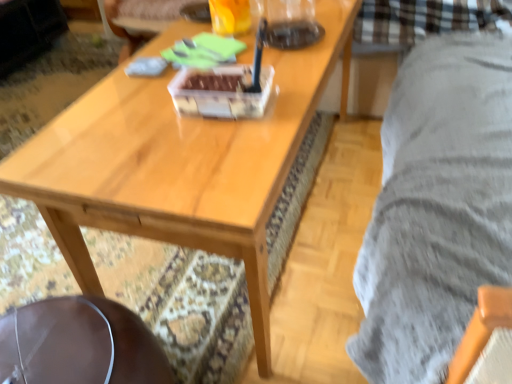
Question: Could wooden coffee table at center be considered to be inside translucent glass beverage at upper center?

Choices:
 (A) yes
 (B) no

Answer: (B)

Question: Does translucent glass beverage at upper center have a lesser width compared to wooden coffee table at center?

Choices:
 (A) no
 (B) yes

Answer: (B)

Question: Does translucent glass beverage at upper center have a greater width compared to wooden coffee table at center?

Choices:
 (A) yes
 (B) no

Answer: (B)

Question: Is translucent glass beverage at upper center turned away from wooden coffee table at center?

Choices:
 (A) no
 (B) yes

Answer: (A)

Question: Is translucent glass beverage at upper center not inside wooden coffee table at center?

Choices:
 (A) yes
 (B) no

Answer: (A)

Question: Is translucent glass beverage at upper center closer to camera compared to wooden coffee table at center?

Choices:
 (A) yes
 (B) no

Answer: (B)

Question: Considering the relative positions of brown leather swivel chair at lower left and wooden coffee table at center in the image provided, is brown leather swivel chair at lower left to the right of wooden coffee table at center from the viewer's perspective?

Choices:
 (A) no
 (B) yes

Answer: (A)

Question: From the image's perspective, is brown leather swivel chair at lower left located beneath wooden coffee table at center?

Choices:
 (A) no
 (B) yes

Answer: (B)

Question: Would you say brown leather swivel chair at lower left is outside wooden coffee table at center?

Choices:
 (A) yes
 (B) no

Answer: (A)

Question: From the image's perspective, is brown leather swivel chair at lower left on wooden coffee table at center?

Choices:
 (A) yes
 (B) no

Answer: (B)

Question: From a real-world perspective, is brown leather swivel chair at lower left physically above wooden coffee table at center?

Choices:
 (A) yes
 (B) no

Answer: (B)

Question: Does brown leather swivel chair at lower left have a greater height compared to wooden coffee table at center?

Choices:
 (A) yes
 (B) no

Answer: (B)

Question: Does translucent glass beverage at upper center appear on the left side of brown leather swivel chair at lower left?

Choices:
 (A) yes
 (B) no

Answer: (B)